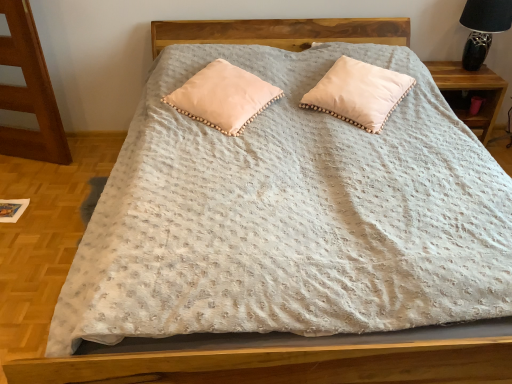
I want to click on free point above wooden nightstand at right (from a real-world perspective), so click(457, 74).